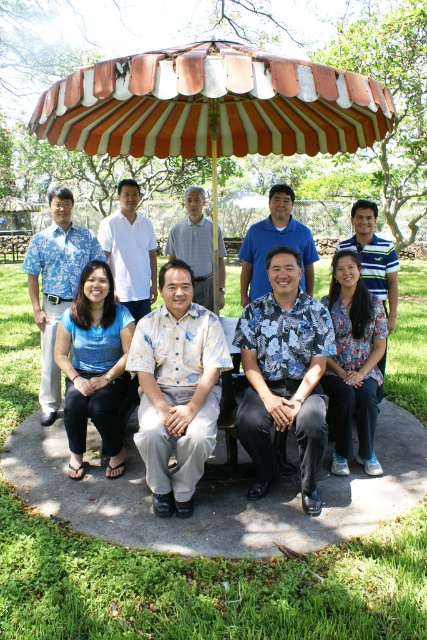
Can you confirm if striped fabric umbrella at center is positioned above blue floral shirt at center?

Indeed, striped fabric umbrella at center is positioned over blue floral shirt at center.

Measure the distance between point (84, 141) and camera.

The distance of point (84, 141) from camera is 16.39 feet.

Is point (137, 108) farther from camera compared to point (275, 397)?

Yes, it is.

The image size is (427, 640). Identify the location of striped fabric umbrella at center. (213, 106).